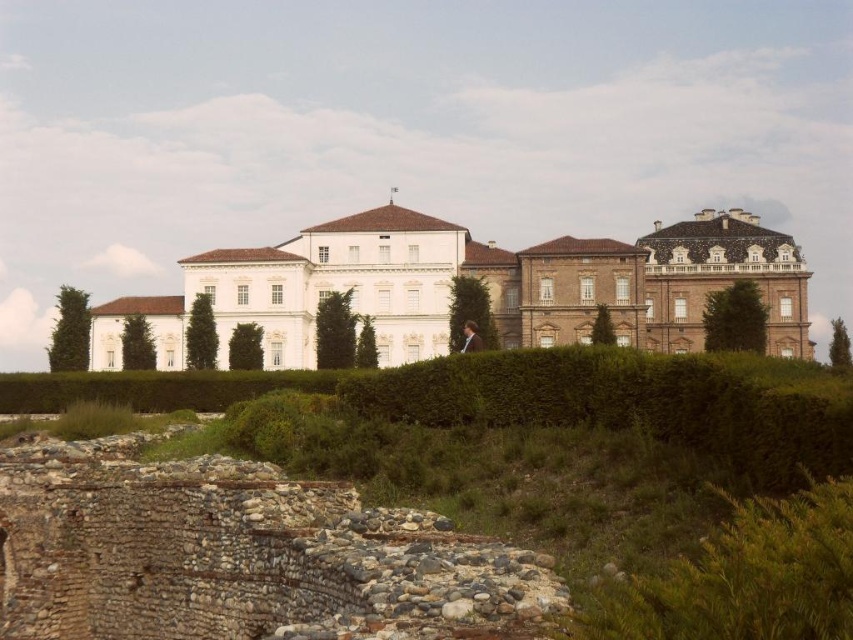
Question: In this image, where is white smooth mansion at center located relative to brown fuzzy coat at center?

Choices:
 (A) right
 (B) left

Answer: (B)

Question: Which point is farther to the camera?

Choices:
 (A) white smooth mansion at center
 (B) brown fuzzy coat at center

Answer: (A)

Question: Can you confirm if white smooth mansion at center is thinner than brown fuzzy coat at center?

Choices:
 (A) yes
 (B) no

Answer: (B)

Question: Can you confirm if white smooth mansion at center is thinner than brown fuzzy coat at center?

Choices:
 (A) no
 (B) yes

Answer: (A)